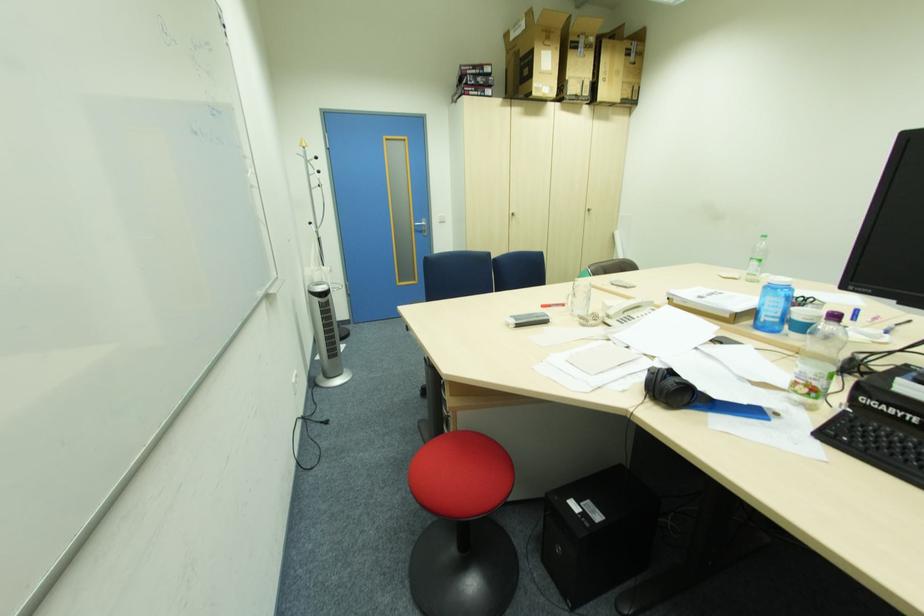
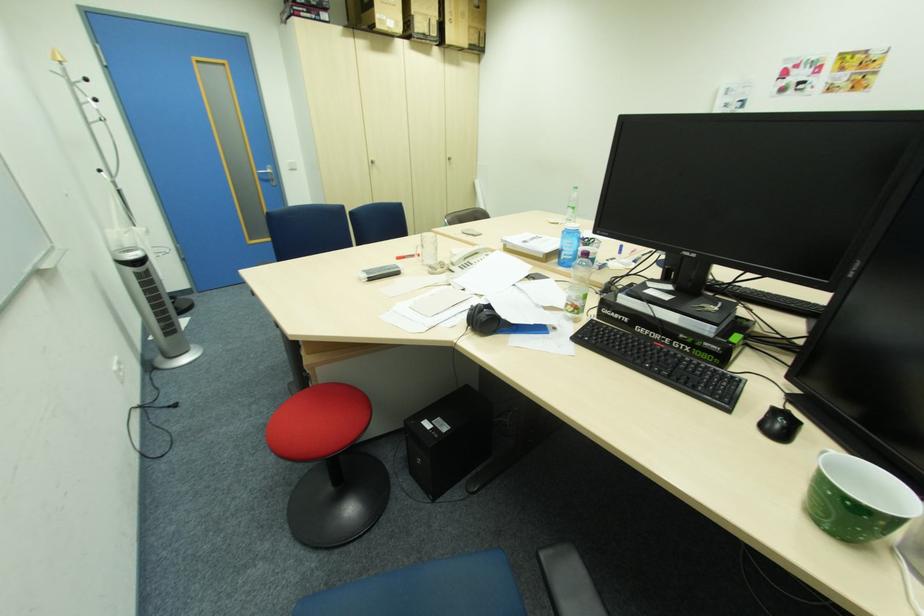
Find the pixel in the second image that matches point 751,403 in the first image.

(538, 323)